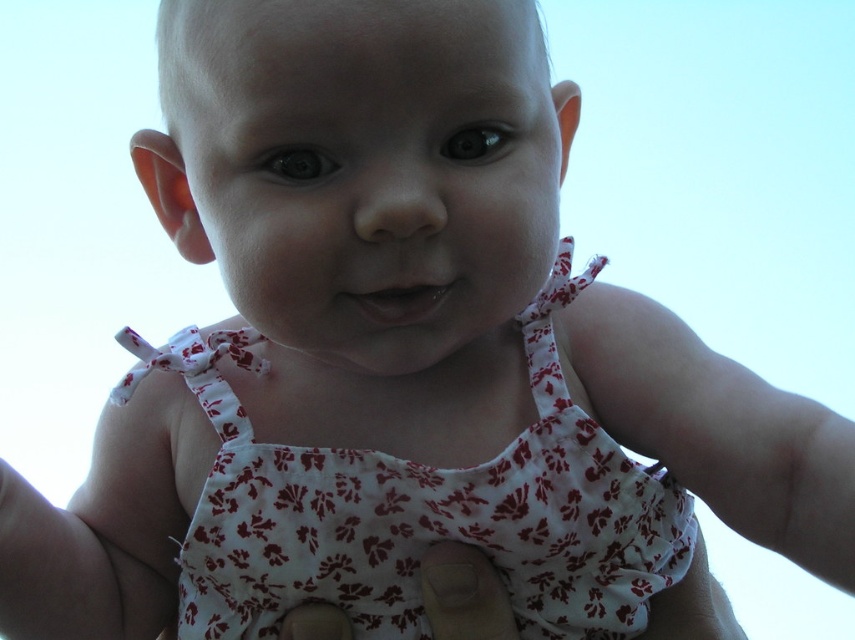
Can you confirm if white floral fabric dress at center is shorter than white fabric diaper at center?

Incorrect, white floral fabric dress at center's height does not fall short of white fabric diaper at center's.

Does white floral fabric dress at center lie behind white fabric diaper at center?

No, it is not.

Is point (214, 352) farther from viewer compared to point (447, 595)?

That is True.

The width and height of the screenshot is (855, 640). I want to click on white floral fabric dress at center, so click(419, 506).